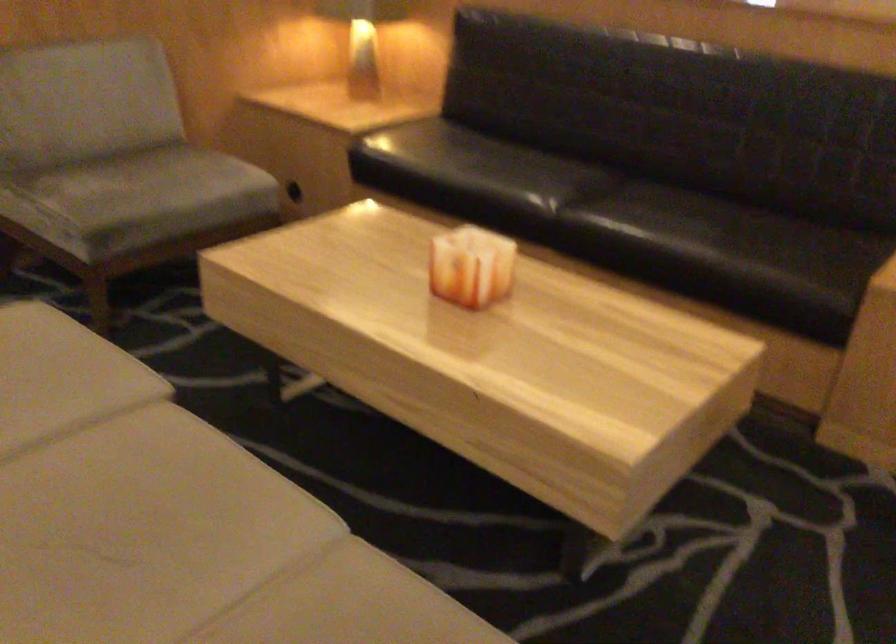
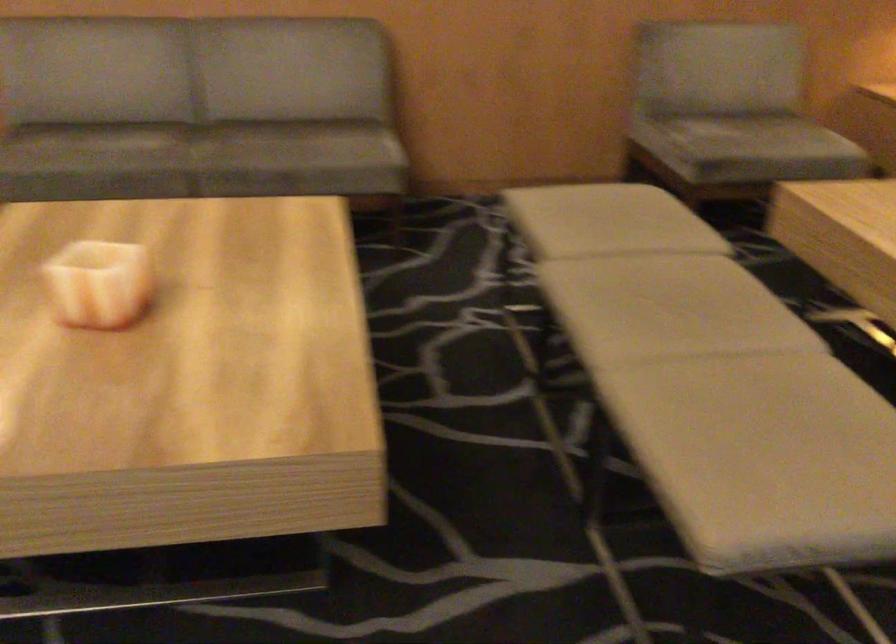
Question: Based on the continuous images, in which direction is the camera rotating? Reply with the corresponding letter.

Choices:
 (A) Left
 (B) Right
 (C) Up
 (D) Down

Answer: (A)